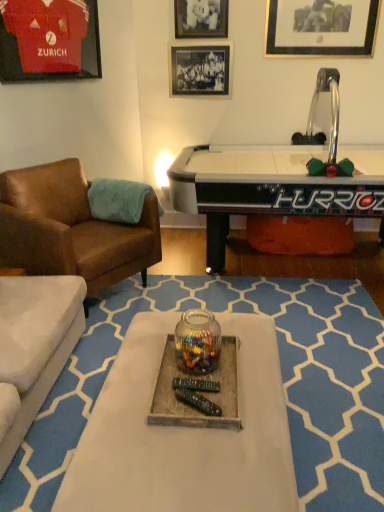
Question: Should I look upward or downward to see white wood tray at center, which is the second table in top-to-bottom order?

Choices:
 (A) up
 (B) down

Answer: (B)

Question: Is metallic silver picture frame at upper center, acting as the second picture frame starting from the right, outside of white wood tray at center, which is the second table in top-to-bottom order?

Choices:
 (A) no
 (B) yes

Answer: (B)

Question: Is metallic silver picture frame at upper center, acting as the second picture frame starting from the right, turned away from white wood tray at center, which is the second table in top-to-bottom order?

Choices:
 (A) yes
 (B) no

Answer: (B)

Question: Does metallic silver picture frame at upper center, positioned as the third picture frame in left-to-right order, have a smaller size compared to white wood tray at center, which ranks as the 1th table in bottom-to-top order?

Choices:
 (A) yes
 (B) no

Answer: (A)

Question: Considering the relative sizes of metallic silver picture frame at upper center, positioned as the third picture frame in left-to-right order, and white wood tray at center, which is the second table in top-to-bottom order, in the image provided, is metallic silver picture frame at upper center, positioned as the third picture frame in left-to-right order, wider than white wood tray at center, which is the second table in top-to-bottom order,?

Choices:
 (A) yes
 (B) no

Answer: (B)

Question: Considering the relative positions of metallic silver picture frame at upper center, positioned as the third picture frame in left-to-right order, and white wood tray at center, which ranks as the 1th table in bottom-to-top order, in the image provided, is metallic silver picture frame at upper center, positioned as the third picture frame in left-to-right order, in front of white wood tray at center, which ranks as the 1th table in bottom-to-top order,?

Choices:
 (A) no
 (B) yes

Answer: (A)

Question: Considering the relative sizes of metallic silver picture frame at upper center, acting as the second picture frame starting from the right, and white wood tray at center, which ranks as the 1th table in bottom-to-top order, in the image provided, is metallic silver picture frame at upper center, acting as the second picture frame starting from the right, thinner than white wood tray at center, which ranks as the 1th table in bottom-to-top order,?

Choices:
 (A) no
 (B) yes

Answer: (B)

Question: Is white wood tray at center, which is the second table in top-to-bottom order, positioned behind translucent glass jar at center?

Choices:
 (A) yes
 (B) no

Answer: (B)

Question: Is white wood tray at center, which ranks as the 1th table in bottom-to-top order, bigger than translucent glass jar at center?

Choices:
 (A) no
 (B) yes

Answer: (B)

Question: Would you consider white wood tray at center, which is the second table in top-to-bottom order, to be distant from translucent glass jar at center?

Choices:
 (A) no
 (B) yes

Answer: (A)

Question: Is white wood tray at center, which is the second table in top-to-bottom order, positioned beyond the bounds of translucent glass jar at center?

Choices:
 (A) no
 (B) yes

Answer: (B)

Question: Is white wood tray at center, which is the second table in top-to-bottom order, facing towards translucent glass jar at center?

Choices:
 (A) no
 (B) yes

Answer: (A)

Question: Is white wood tray at center, which is the second table in top-to-bottom order, looking in the opposite direction of translucent glass jar at center?

Choices:
 (A) no
 (B) yes

Answer: (A)

Question: Is translucent glass jar at center facing towards brown leather chair at left?

Choices:
 (A) yes
 (B) no

Answer: (B)